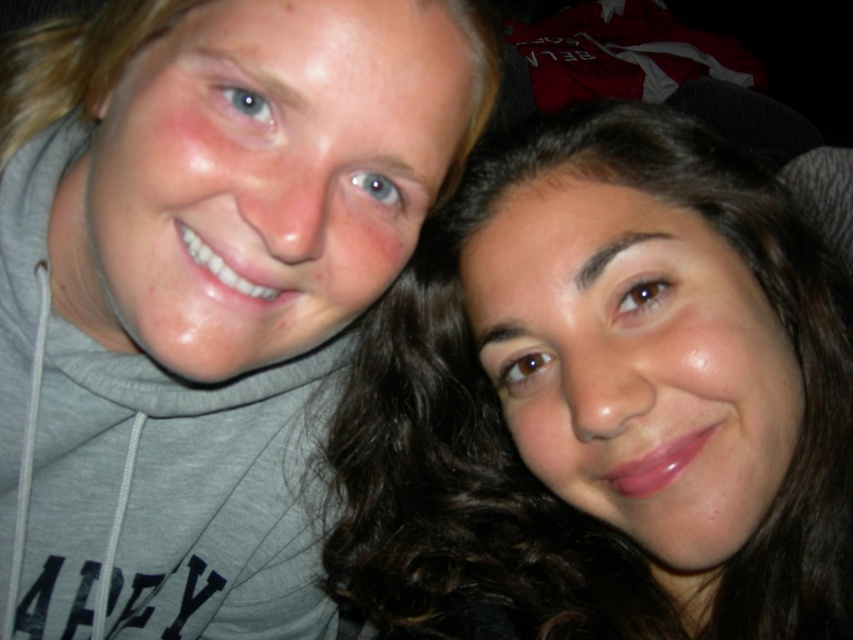
In the scene shown: Is matte gray hoodie at upper left positioned in front of smooth brown hair at center?

Yes, matte gray hoodie at upper left is in front of smooth brown hair at center.

Is matte gray hoodie at upper left bigger than smooth brown hair at center?

Indeed, matte gray hoodie at upper left has a larger size compared to smooth brown hair at center.

Is point (294, 144) positioned behind point (639, 561)?

No, (294, 144) is closer to viewer.

What are the coordinates of `matte gray hoodie at upper left` in the screenshot? It's located at (202, 291).